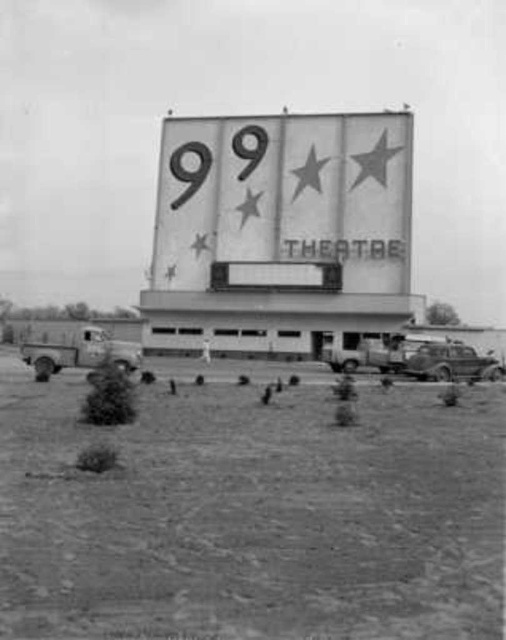
Who is more forward, (489, 502) or (405, 355)?

Point (489, 502)

From the picture: Which is more to the left, dirt field at lower center or shiny chrome sedan at right?

dirt field at lower center is more to the left.

Is point (119, 545) in front of point (490, 360)?

Yes, it is in front of point (490, 360).

The image size is (506, 640). I want to click on dirt field at lower center, so click(254, 515).

Is dirt field at lower center positioned before metallic silver sign at center?

Yes.

Which is above, dirt field at lower center or metallic silver sign at center?

metallic silver sign at center is above.

The image size is (506, 640). What are the coordinates of `dirt field at lower center` in the screenshot? It's located at (254, 515).

This screenshot has width=506, height=640. Describe the element at coordinates (285, 196) in the screenshot. I see `metallic silver sign at center` at that location.

Between point (171, 252) and point (478, 358), which one is positioned in front?

Point (478, 358) is more forward.

Between point (365, 177) and point (419, 349), which one is positioned behind?

Positioned behind is point (365, 177).

Identify the location of metallic silver sign at center. (285, 196).